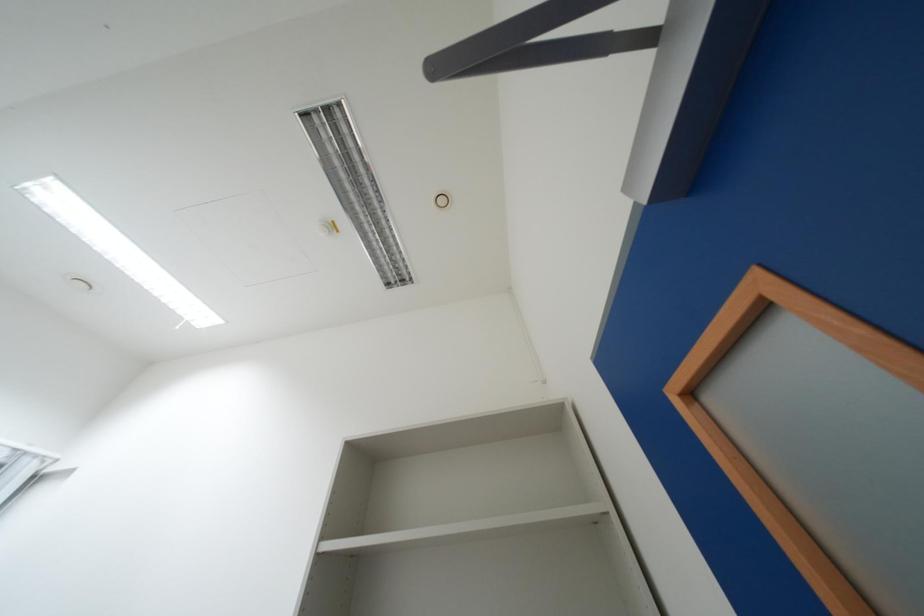
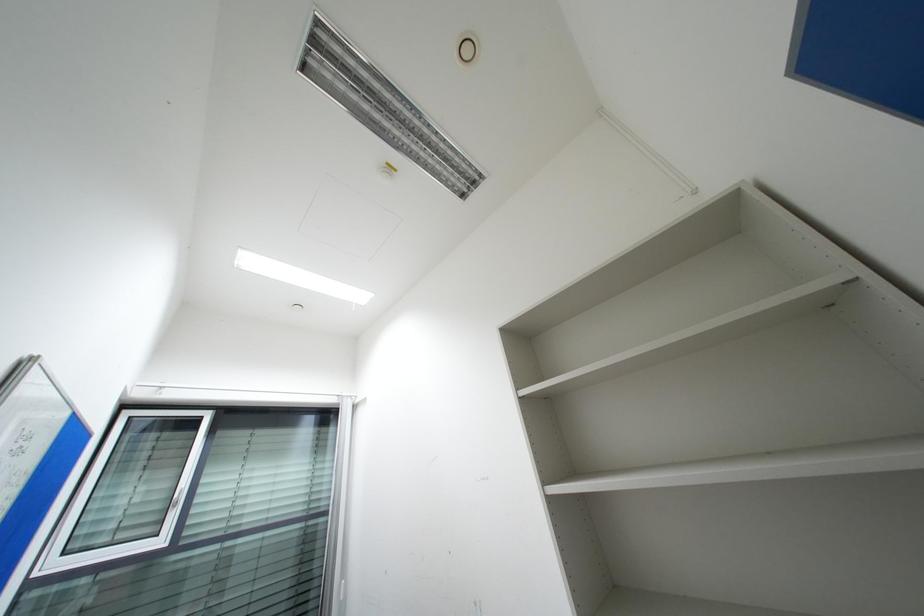
Question: How did the camera likely rotate?

Choices:
 (A) Left
 (B) Right
 (C) Up
 (D) Down

Answer: (A)